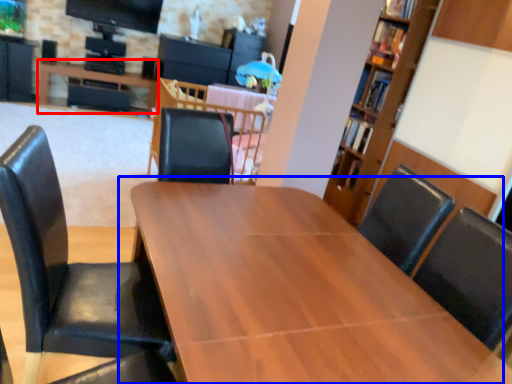
Question: Which of the following is the farthest to the observer, table (highlighted by a red box) or table (highlighted by a blue box)?

Choices:
 (A) table
 (B) table

Answer: (A)